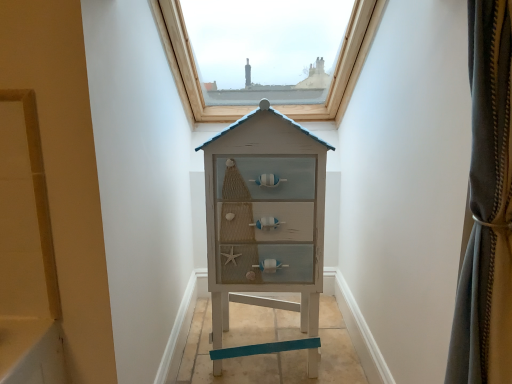
I want to click on white distressed wood chest of drawers at center, so click(265, 224).

This screenshot has height=384, width=512. What do you see at coordinates (265, 224) in the screenshot? I see `white distressed wood chest of drawers at center` at bounding box center [265, 224].

Measure the distance between white distressed wood chest of drawers at center and camera.

white distressed wood chest of drawers at center is 4.39 feet from camera.

The height and width of the screenshot is (384, 512). Describe the element at coordinates (344, 65) in the screenshot. I see `wooden frame at upper center` at that location.

Find the location of a particular element. Image resolution: width=512 pixels, height=384 pixels. wooden frame at upper center is located at coordinates (344, 65).

Where is `white distressed wood chest of drawers at center`? white distressed wood chest of drawers at center is located at coordinates (265, 224).

Is white distressed wood chest of drawers at center to the right of wooden frame at upper center from the viewer's perspective?

Yes, white distressed wood chest of drawers at center is to the right of wooden frame at upper center.

Considering their positions, is white distressed wood chest of drawers at center located in front of or behind wooden frame at upper center?

white distressed wood chest of drawers at center is in front of wooden frame at upper center.

Does point (265, 103) appear closer or farther from the camera than point (193, 68)?

Point (265, 103).

From the image's perspective, which one is positioned lower, white distressed wood chest of drawers at center or wooden frame at upper center?

white distressed wood chest of drawers at center, from the image's perspective.

From a real-world perspective, which object rests below the other?

→ white distressed wood chest of drawers at center.

Considering the sizes of objects white distressed wood chest of drawers at center and wooden frame at upper center in the image provided, who is wider, white distressed wood chest of drawers at center or wooden frame at upper center?

With larger width is wooden frame at upper center.

Can you confirm if white distressed wood chest of drawers at center is shorter than wooden frame at upper center?

No.

Looking at the image, does white distressed wood chest of drawers at center seem bigger or smaller compared to wooden frame at upper center?

Clearly, white distressed wood chest of drawers at center is smaller in size than wooden frame at upper center.

Is wooden frame at upper center a part of white distressed wood chest of drawers at center?

No, wooden frame at upper center is not inside white distressed wood chest of drawers at center.

Does white distressed wood chest of drawers at center touch wooden frame at upper center?

No, white distressed wood chest of drawers at center is not next to wooden frame at upper center.

Is wooden frame at upper center at the back of white distressed wood chest of drawers at center?

Yes, white distressed wood chest of drawers at center's orientation is away from wooden frame at upper center.

How many degrees apart are the facing directions of white distressed wood chest of drawers at center and wooden frame at upper center?

The angle between the facing direction of white distressed wood chest of drawers at center and the facing direction of wooden frame at upper center is 3.58 degrees.

Where is `chest of drawers on the right of wooden frame at upper center`? chest of drawers on the right of wooden frame at upper center is located at coordinates (265, 224).

Looking at this image, considering the relative positions of wooden frame at upper center and white distressed wood chest of drawers at center in the image provided, is wooden frame at upper center to the right of white distressed wood chest of drawers at center from the viewer's perspective?

No, wooden frame at upper center is not to the right of white distressed wood chest of drawers at center.

Is wooden frame at upper center in front of or behind white distressed wood chest of drawers at center in the image?

wooden frame at upper center is behind white distressed wood chest of drawers at center.

Is point (189, 49) positioned after point (212, 318)?

That is True.

From the image's perspective, is wooden frame at upper center above or below white distressed wood chest of drawers at center?

wooden frame at upper center is situated higher than white distressed wood chest of drawers at center in the image.

From a real-world perspective, is wooden frame at upper center beneath white distressed wood chest of drawers at center?

No, from a real-world perspective, wooden frame at upper center is not under white distressed wood chest of drawers at center.

In the scene shown: Which object is wider, wooden frame at upper center or white distressed wood chest of drawers at center?

Wider between the two is wooden frame at upper center.

Considering the relative sizes of wooden frame at upper center and white distressed wood chest of drawers at center in the image provided, is wooden frame at upper center shorter than white distressed wood chest of drawers at center?

Yes.

Considering the sizes of objects wooden frame at upper center and white distressed wood chest of drawers at center in the image provided, who is bigger, wooden frame at upper center or white distressed wood chest of drawers at center?

With larger size is wooden frame at upper center.

Is wooden frame at upper center outside of white distressed wood chest of drawers at center?

wooden frame at upper center lies outside white distressed wood chest of drawers at center's area.

Are wooden frame at upper center and white distressed wood chest of drawers at center located far from each other?

Actually, wooden frame at upper center and white distressed wood chest of drawers at center are a little close together.

Based on the photo, is wooden frame at upper center turned away from white distressed wood chest of drawers at center?

That's not correct — wooden frame at upper center is not looking away from white distressed wood chest of drawers at center.

Find the location of a particular element. The width and height of the screenshot is (512, 384). the chest of drawers in front of the wooden frame at upper center is located at coordinates (265, 224).

Image resolution: width=512 pixels, height=384 pixels. In order to click on window lying behind the white distressed wood chest of drawers at center in this screenshot , I will do `click(344, 65)`.

Where is `the chest of drawers below the wooden frame at upper center (from the image's perspective)`? the chest of drawers below the wooden frame at upper center (from the image's perspective) is located at coordinates (265, 224).